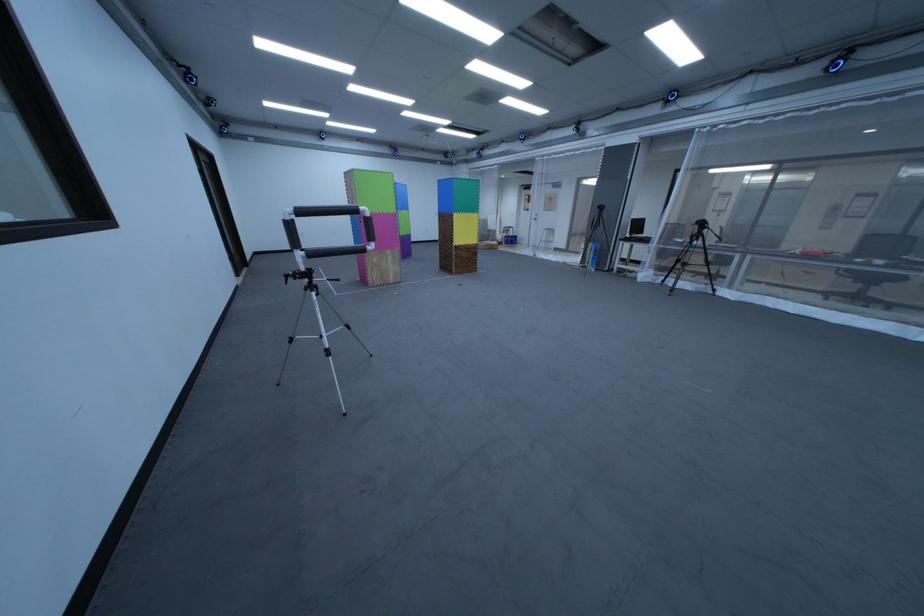
This screenshot has height=616, width=924. What do you see at coordinates (324, 209) in the screenshot?
I see `the black foam frame` at bounding box center [324, 209].